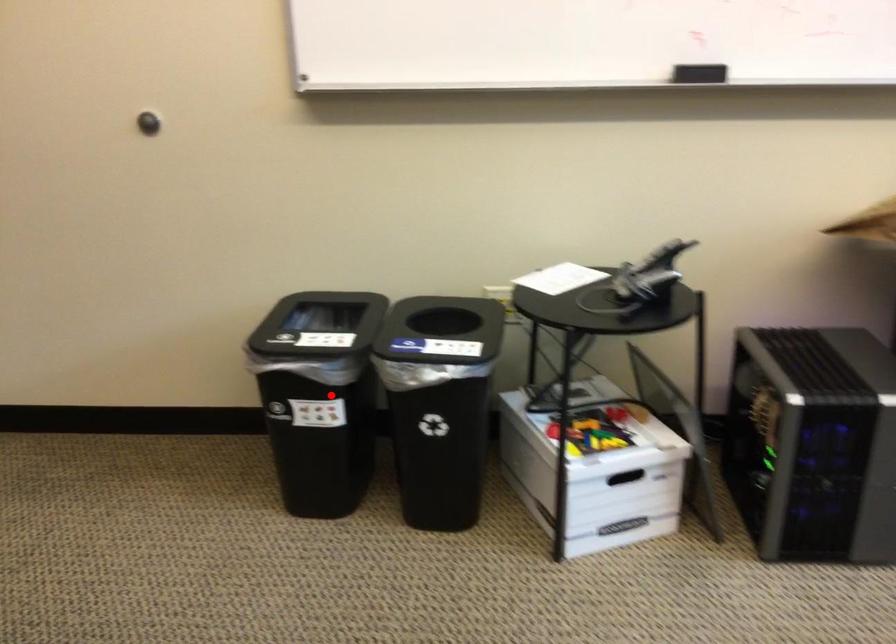
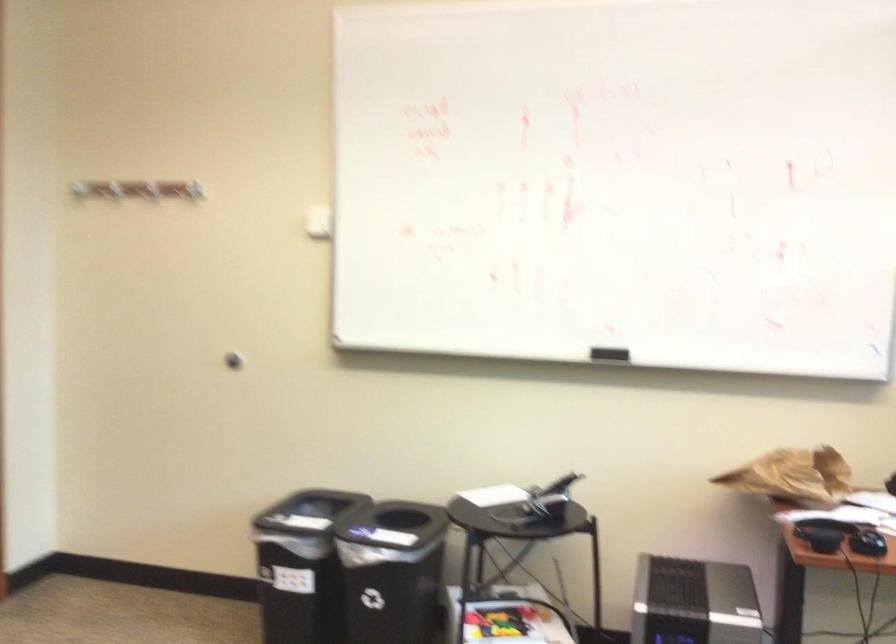
Find the pixel in the second image that matches the highlighted location in the first image.

(300, 565)